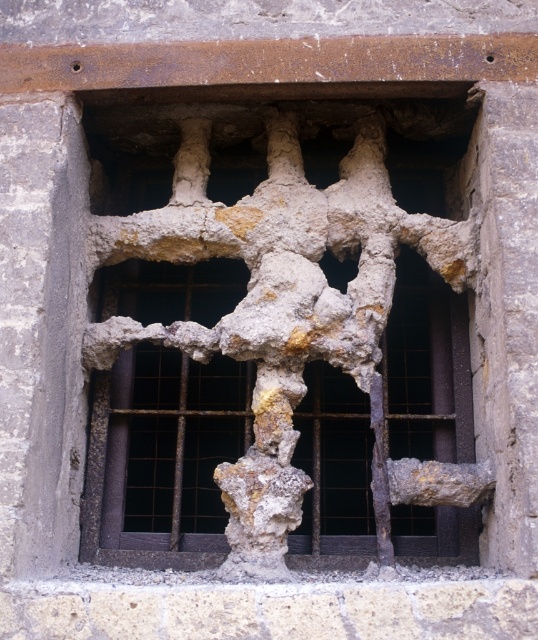
You have a crumbly stone sculpture at center and a rusty metal hole at center in front of you. Can the sculpture fit through the hole?

The crumbly stone sculpture at center might be wider than the rusty metal hole at center, so it may not fit through.

You are an architect examining the stone window frame. You notice two points on the frame at coordinates point (310, 410) and point (329, 253). Which point is closer to your current position?

Point (310, 410) is further to the viewer than point (329, 253), so the point (329, 253) is closer to your current position.

You are an architect inspecting the stone window frame. You notice the crumbly stone sculpture at center and the rusty metal hole at center. Which object is positioned higher up in the window frame?

The rusty metal hole at center is positioned higher up in the window frame than the crumbly stone sculpture at center because the crumbly stone sculpture at center is located below it.